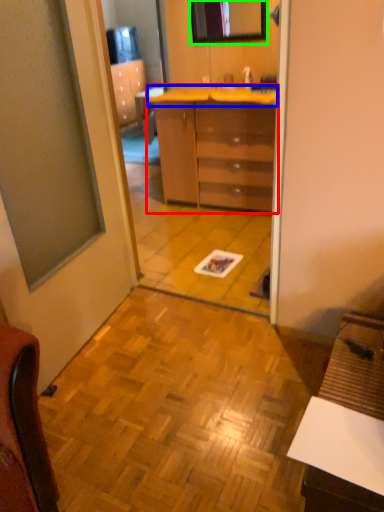
Question: Considering the real-world distances, which object is farthest from chest of drawers (highlighted by a red box)? counter top (highlighted by a blue box) or mirror (highlighted by a green box)?

Choices:
 (A) counter top
 (B) mirror

Answer: (B)